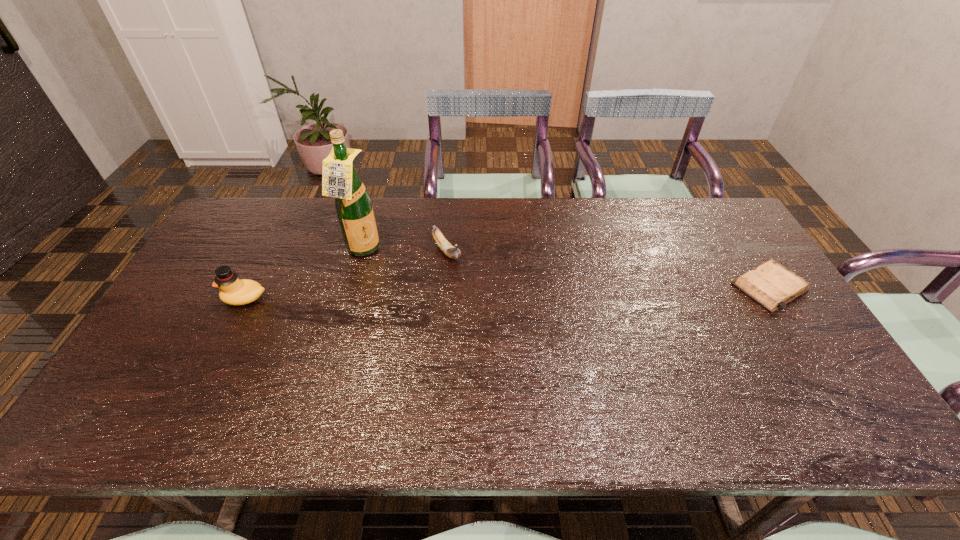
This screenshot has width=960, height=540. I want to click on unoccupied position between the leftmost object and the banana, so click(346, 275).

The image size is (960, 540). I want to click on empty space between the liquor and the shortest object, so click(565, 269).

I want to click on free point between the third tallest object and the liquor, so click(x=404, y=251).

The width and height of the screenshot is (960, 540). I want to click on free space between the second object from right to left and the rightmost object, so click(608, 269).

Where is `free space between the rightmost object and the duck`? The width and height of the screenshot is (960, 540). free space between the rightmost object and the duck is located at coordinates (507, 293).

I want to click on vacant point located between the second object from left to right and the banana, so click(x=404, y=251).

In order to click on free area in between the leftmost object and the rightmost object in this screenshot , I will do `click(507, 293)`.

Image resolution: width=960 pixels, height=540 pixels. I want to click on object that is the third closest to the third object from left to right, so tap(771, 285).

Identify the location of object identified as the third closest to the duck. Image resolution: width=960 pixels, height=540 pixels. (771, 285).